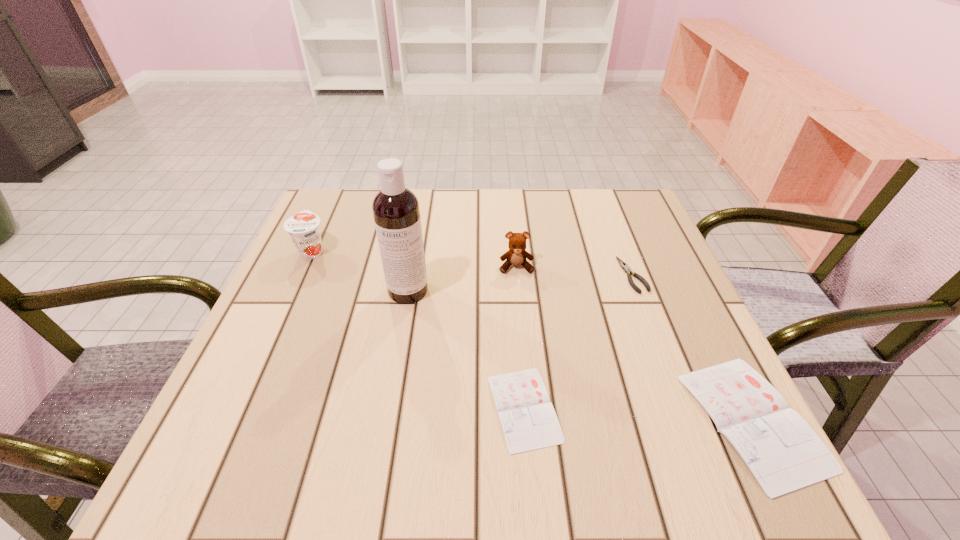
Where is `free space that is in between the second shortest object and the teddy bear`? The width and height of the screenshot is (960, 540). free space that is in between the second shortest object and the teddy bear is located at coordinates (574, 271).

Image resolution: width=960 pixels, height=540 pixels. Identify the location of free space between the shortest object and the pliers. (x=578, y=342).

Where is `free area in between the yogurt and the fifth object from right to left`? The width and height of the screenshot is (960, 540). free area in between the yogurt and the fifth object from right to left is located at coordinates pyautogui.click(x=360, y=271).

Locate an element on the screen. The width and height of the screenshot is (960, 540). vacant space that's between the yogurt and the taller diary is located at coordinates (533, 335).

Locate an element on the screen. This screenshot has height=540, width=960. vacant space that is in between the fifth object from right to left and the leftmost object is located at coordinates (360, 271).

What are the coordinates of `vacant area between the pliers and the leftmost object` in the screenshot? It's located at (472, 263).

Locate an element on the screen. blank region between the dishwasher detergent and the yogurt is located at coordinates pos(360,271).

In order to click on object that ranks as the third closest to the teddy bear in this screenshot , I will do `click(528, 419)`.

Locate an element on the screen. This screenshot has width=960, height=540. object identified as the third closest to the teddy bear is located at coordinates (528, 419).

Locate an element on the screen. vacant space that satisfies the following two spatial constraints: 1. on the label side of the tallest object; 2. on the right side of the taller diary is located at coordinates (385, 420).